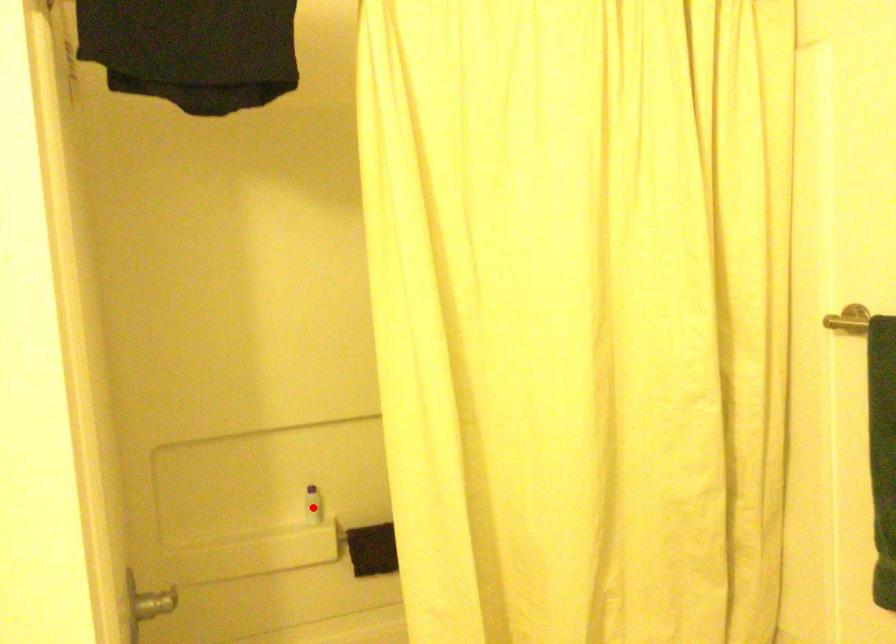
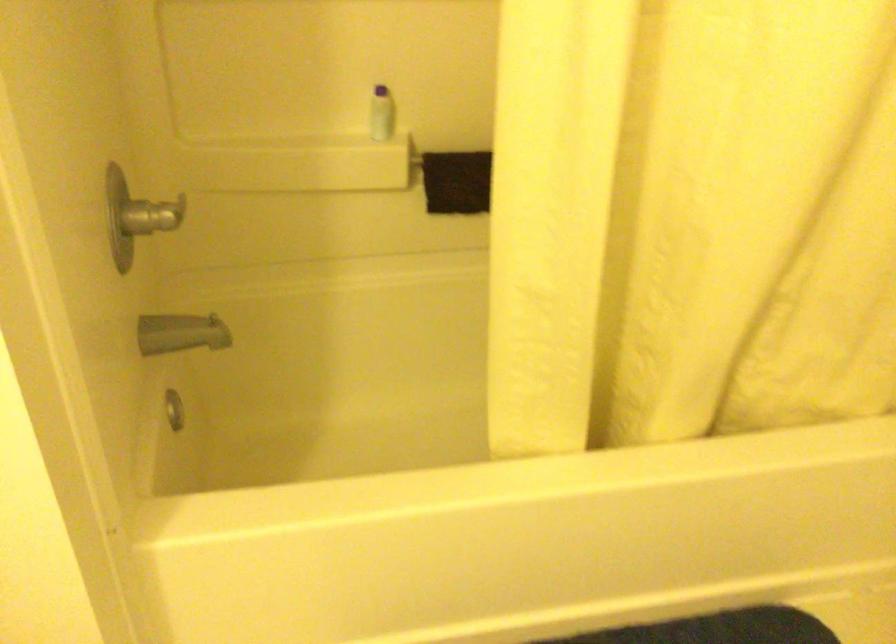
Question: I am providing you with two images of the same scene from different viewpoints. Given a red point in image1, look at the same physical point in image2. Is it:

Choices:
 (A) Closer to the viewpoint
 (B) Farther from the viewpoint

Answer: (A)